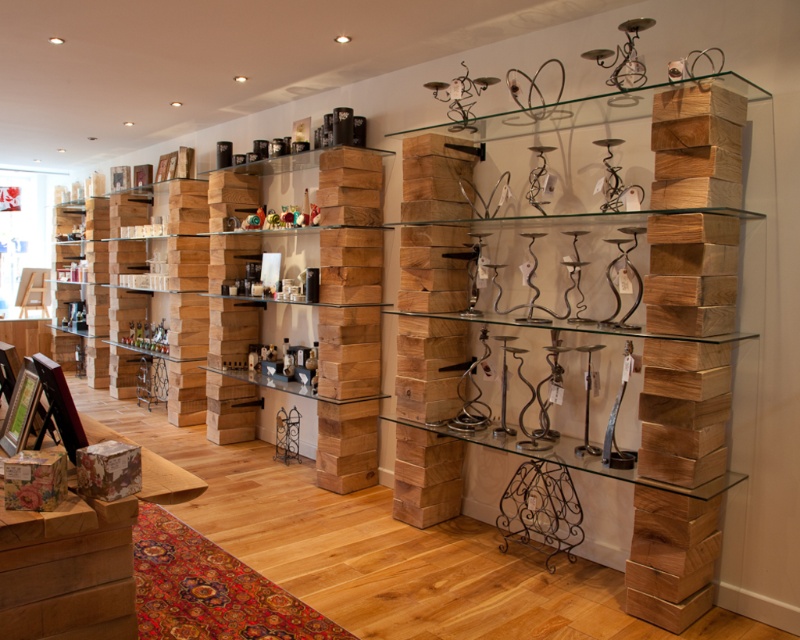
Question: Does natural wood bookshelf at upper right have a lesser width compared to wooden shelves at center?

Choices:
 (A) no
 (B) yes

Answer: (A)

Question: Does natural wood bookshelf at upper right have a lesser width compared to wooden shelves at center?

Choices:
 (A) yes
 (B) no

Answer: (B)

Question: Is natural wood bookshelf at upper right positioned at the back of wooden shelves at center?

Choices:
 (A) yes
 (B) no

Answer: (B)

Question: Which of the following is the closest to the observer?

Choices:
 (A) natural wood bookshelf at upper right
 (B) wooden shelves at center

Answer: (A)

Question: Among these points, which one is farthest from the camera?

Choices:
 (A) (726, 269)
 (B) (370, 324)

Answer: (B)